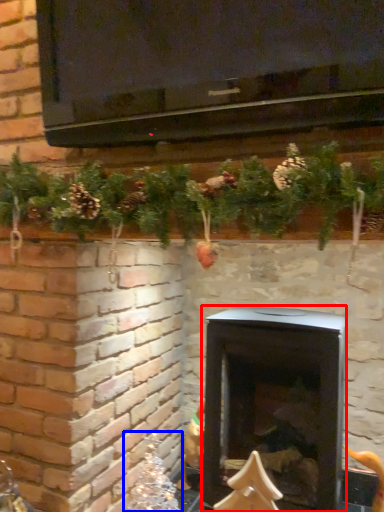
Question: Which object is further to the camera taking this photo, wood burning stove (highlighted by a red box) or christmas decoration (highlighted by a blue box)?

Choices:
 (A) wood burning stove
 (B) christmas decoration

Answer: (B)